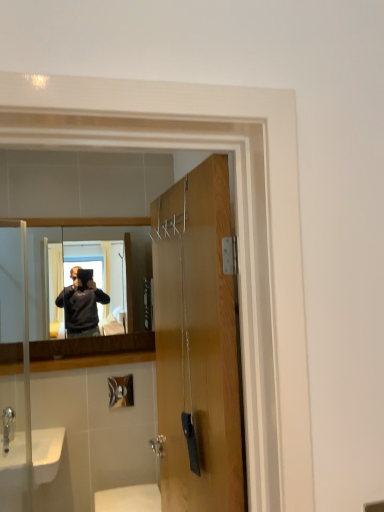
Question: Relative to silver metallic faucet at lower left, is matte wooden mirror at center in front or behind?

Choices:
 (A) front
 (B) behind

Answer: (B)

Question: Considering the positions of matte wooden mirror at center and silver metallic faucet at lower left in the image, is matte wooden mirror at center bigger or smaller than silver metallic faucet at lower left?

Choices:
 (A) small
 (B) big

Answer: (B)

Question: Which is nearer to the white glossy sink at lower left?

Choices:
 (A) wooden door at center
 (B) white glossy toilet at lower center
 (C) matte wooden mirror at center
 (D) silver metallic faucet at lower left

Answer: (D)

Question: Estimate the real-world distances between objects in this image. Which object is closer to the white glossy sink at lower left?

Choices:
 (A) silver metallic faucet at lower left
 (B) matte wooden mirror at center
 (C) white glossy toilet at lower center
 (D) wooden door at center

Answer: (A)